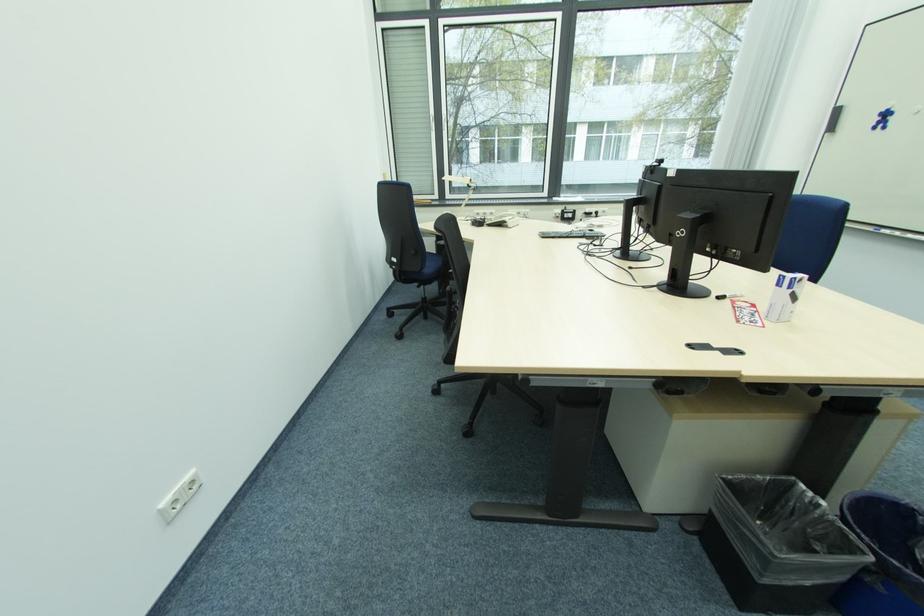
Find the location of a particular element. The image size is (924, 616). small white box is located at coordinates (784, 297).